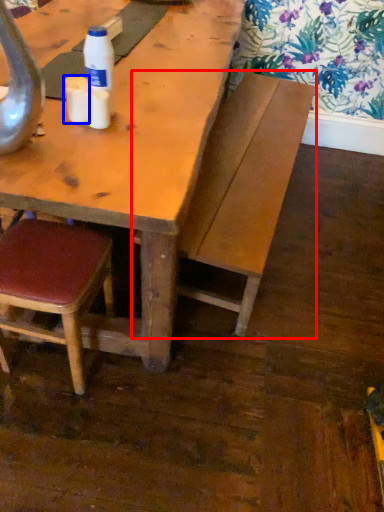
Question: Which object appears farthest to the camera in this image, bench (highlighted by a red box) or coffee cup (highlighted by a blue box)?

Choices:
 (A) bench
 (B) coffee cup

Answer: (A)